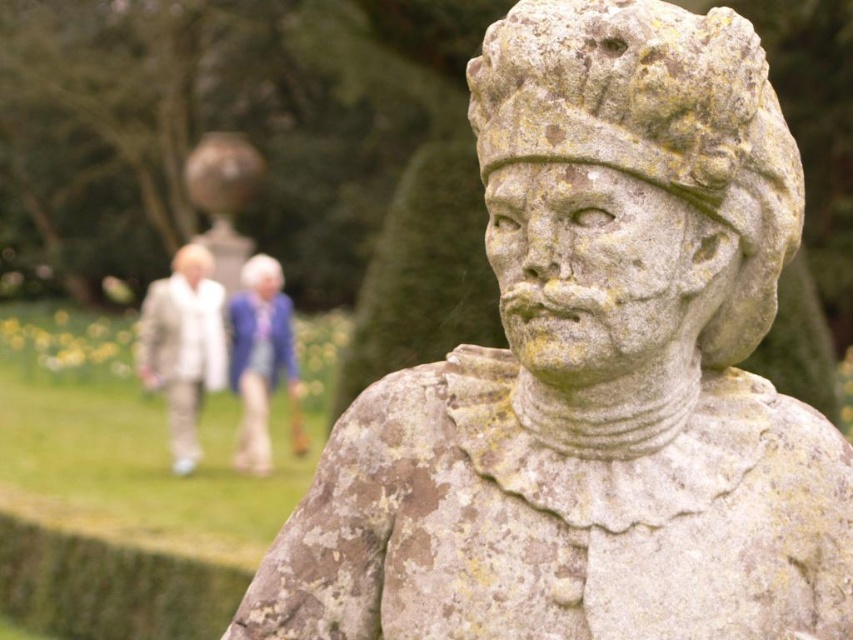
Question: Observing the image, what is the correct spatial positioning of matte stone statue at center in reference to matte stone head at center?

Choices:
 (A) above
 (B) below

Answer: (B)

Question: Considering the real-world distances, which object is farthest from the blue fabric jacket at center?

Choices:
 (A) weathered stone head at center
 (B) matte white head at center

Answer: (A)

Question: Which object is closer to the camera taking this photo?

Choices:
 (A) matte stone statue at center
 (B) matte stone head at center
 (C) matte white head at center

Answer: (A)

Question: Is matte stone statue at center to the right of blue fabric jacket at center from the viewer's perspective?

Choices:
 (A) yes
 (B) no

Answer: (B)

Question: From the image, what is the correct spatial relationship of weathered stone statue at center in relation to matte stone statue at center?

Choices:
 (A) below
 (B) above

Answer: (A)

Question: Based on their relative distances, which object is nearer to the matte stone head at center?

Choices:
 (A) weathered stone head at center
 (B) matte stone statue at center
 (C) matte white head at center

Answer: (C)